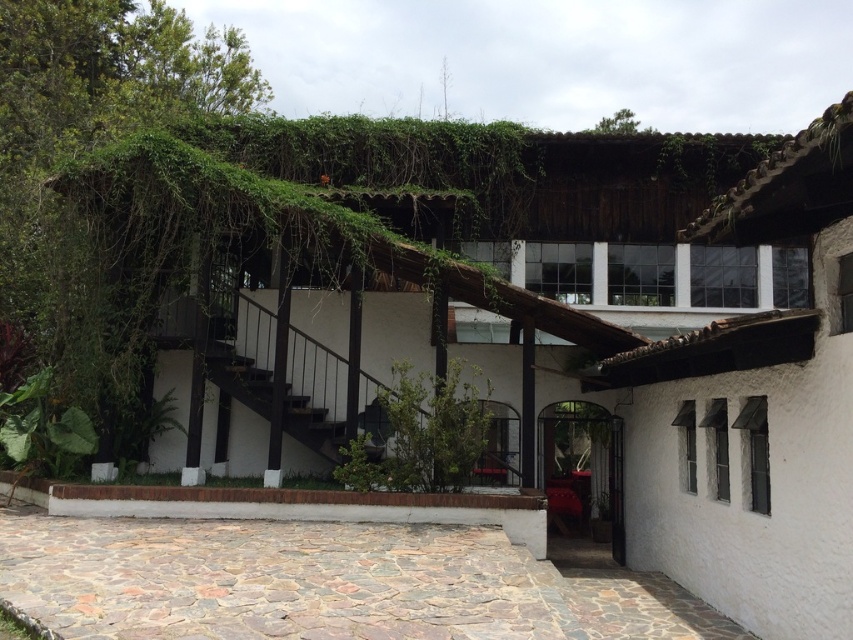
Can you confirm if green leafy plant at center is shorter than green leafy plant at lower left?

In fact, green leafy plant at center may be taller than green leafy plant at lower left.

How far apart are green leafy plant at center and green leafy plant at lower left?

green leafy plant at center and green leafy plant at lower left are 4.42 meters apart.

Who is more distant from viewer, (457, 374) or (32, 412)?

Point (32, 412)

Where is `green leafy plant at center`? This screenshot has width=853, height=640. green leafy plant at center is located at coordinates (421, 435).

Which is below, green leafy plant at lower left or black wooden stairs at center?

green leafy plant at lower left

Find the location of `green leafy plant at lower left`. green leafy plant at lower left is located at coordinates (42, 428).

Where is `green leafy plant at lower left`? green leafy plant at lower left is located at coordinates (42, 428).

Image resolution: width=853 pixels, height=640 pixels. Find the location of `green leafy plant at lower left`. green leafy plant at lower left is located at coordinates (42, 428).

Can you confirm if green leafy plant at center is shorter than black wooden stairs at center?

Yes.

Can you confirm if green leafy plant at center is positioned above black wooden stairs at center?

No.

Between point (402, 394) and point (305, 433), which one is positioned in front?

Positioned in front is point (402, 394).

I want to click on green leafy plant at center, so click(x=421, y=435).